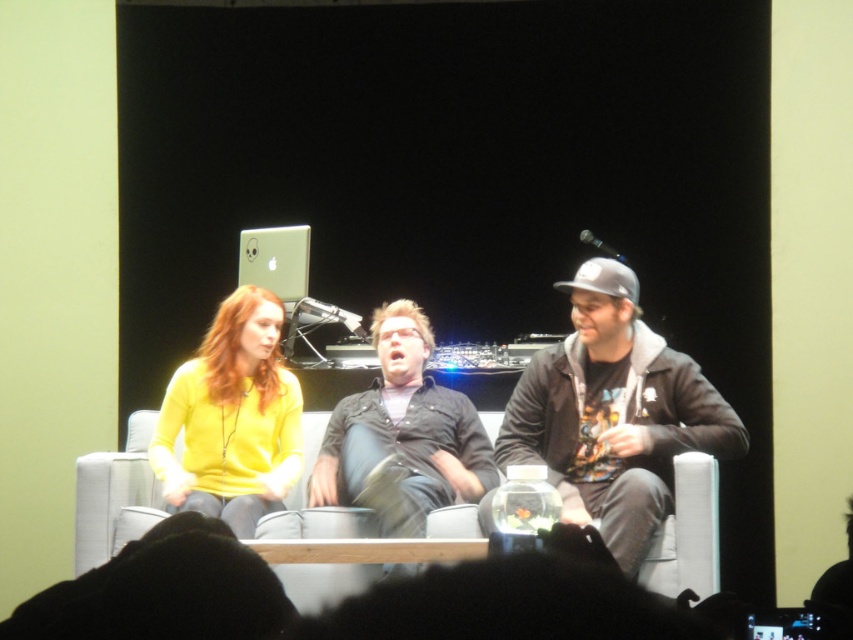
Is matte yellow sweater at center in front of gray fabric couch at center?

Yes, it is in front of gray fabric couch at center.

Can you confirm if matte yellow sweater at center is wider than gray fabric couch at center?

Yes.

Is point (268, 424) positioned behind point (148, 496)?

Yes.

Where is `matte yellow sweater at center`? Image resolution: width=853 pixels, height=640 pixels. matte yellow sweater at center is located at coordinates (231, 419).

In the scene shown: Can you confirm if dark gray hoodie at center is taller than green matte laptop at upper center?

Yes, dark gray hoodie at center is taller than green matte laptop at upper center.

Which of these two, dark gray hoodie at center or green matte laptop at upper center, stands shorter?

Standing shorter between the two is green matte laptop at upper center.

Measure the distance between point (589,493) and camera.

A distance of 3.88 meters exists between point (589,493) and camera.

Image resolution: width=853 pixels, height=640 pixels. In order to click on dark gray hoodie at center in this screenshot , I will do `click(613, 413)`.

Can you confirm if gray fabric couch at center is bigger than green matte laptop at upper center?

Correct, gray fabric couch at center is larger in size than green matte laptop at upper center.

Between gray fabric couch at center and green matte laptop at upper center, which one is positioned lower?

gray fabric couch at center is lower down.

Is point (664, 548) farther from camera compared to point (289, 280)?

That is False.

Locate an element on the screen. This screenshot has width=853, height=640. gray fabric couch at center is located at coordinates (111, 490).